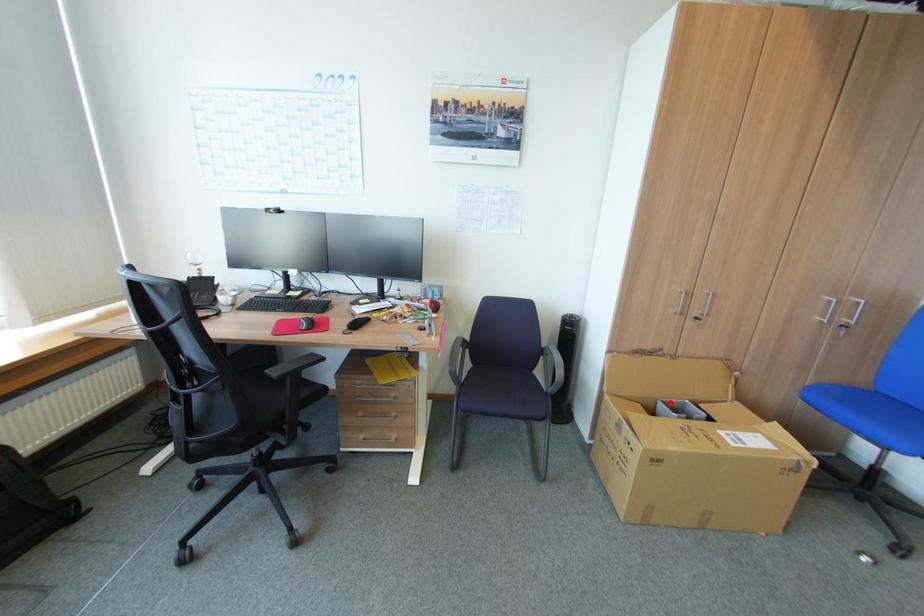
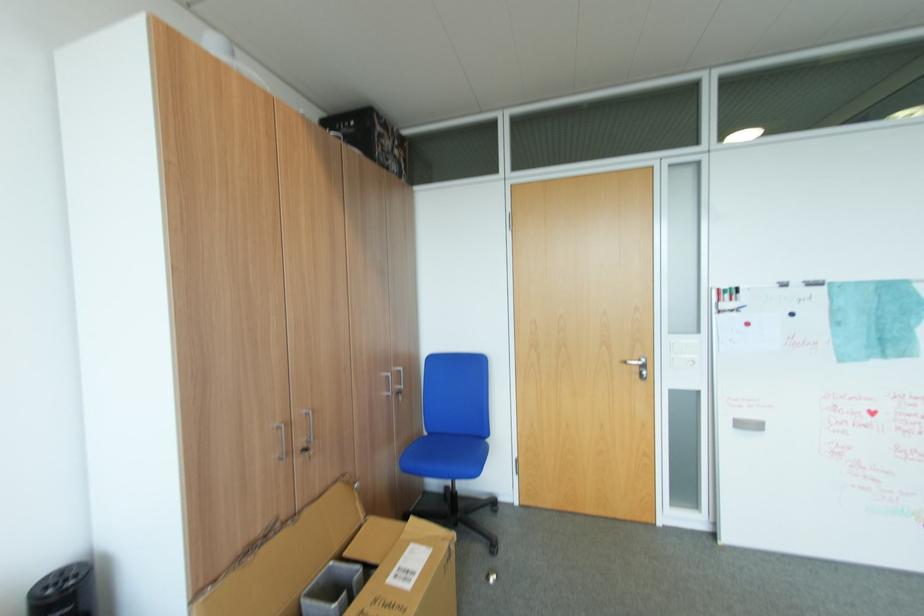
The point at the highlighted location is marked in the first image. Where is the corresponding point in the second image?

(317, 593)